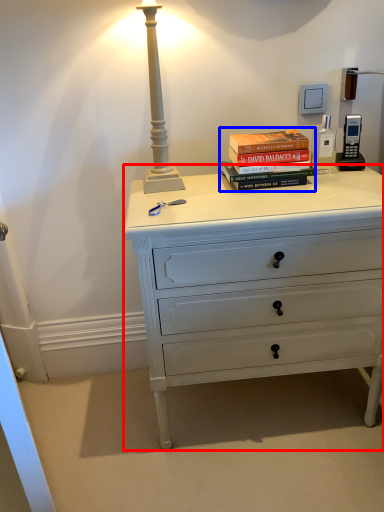
Question: Which object appears farthest to the camera in this image, chest of drawers (highlighted by a red box) or book (highlighted by a blue box)?

Choices:
 (A) chest of drawers
 (B) book

Answer: (B)